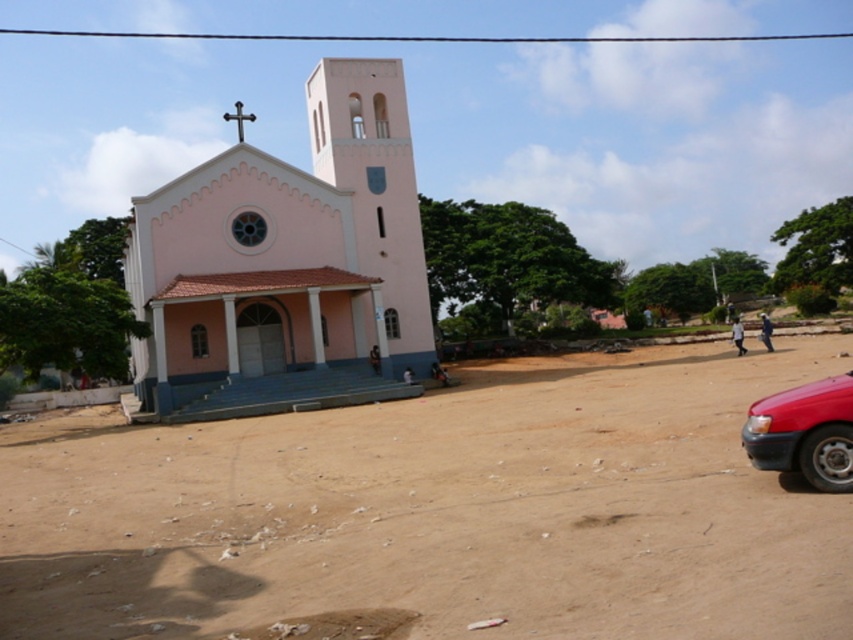
You are standing at the point labeled point (82, 582) and want to walk to the church entrance. Is the point labeled point (837, 410) between you and the church entrance?

Point (82, 582) is in front of point (837, 410), so the point labeled point (837, 410) is behind you and not between you and the church entrance.

From the picture: You are a delivery driver who needs to park your shiny red car at lower right on the brown sandy dirt field at center. Can you fit your car there without overlapping the field?

The brown sandy dirt field at center might be wider than shiny red car at lower right, so it is possible that the car can fit within the field without overlapping, but there is uncertainty due to the comparative width.